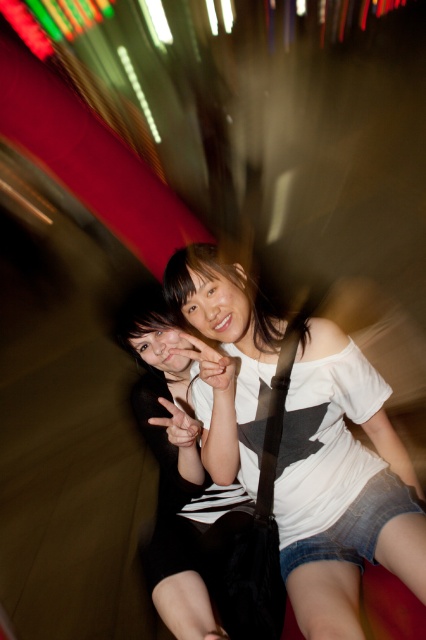
You are a photographer trying to capture a candid shot of the two people in the image. The minimum focus distance for your camera is 8 inches. Will you be able to focus on both the white matte shirt at center and the black matte dress at center simultaneously?

The white matte shirt at center and the black matte dress at center are 8.38 inches apart from each other. Since the minimum focus distance is 8 inches, the camera can focus on both as the distance between them is slightly more than the required minimum focus distance.

You are a photographer trying to capture a group photo. You notice two outfits in the scene, the white matte shirt at center and the black matte dress at center. Which outfit should you suggest someone wear if they want to appear more prominent in the photo?

The black matte dress at center is larger in size compared to the white matte shirt at center, so suggesting the black matte dress at center would make them appear more prominent in the photo.